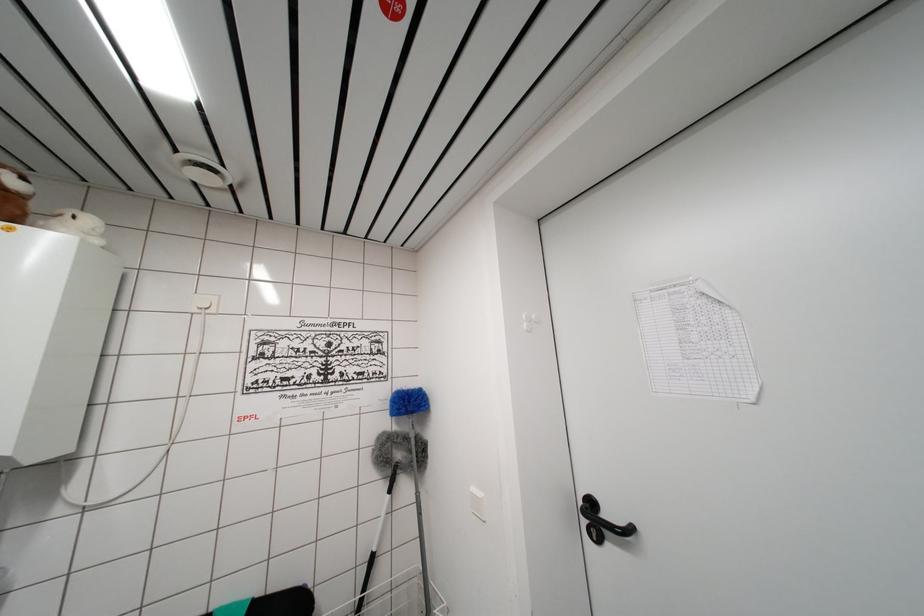
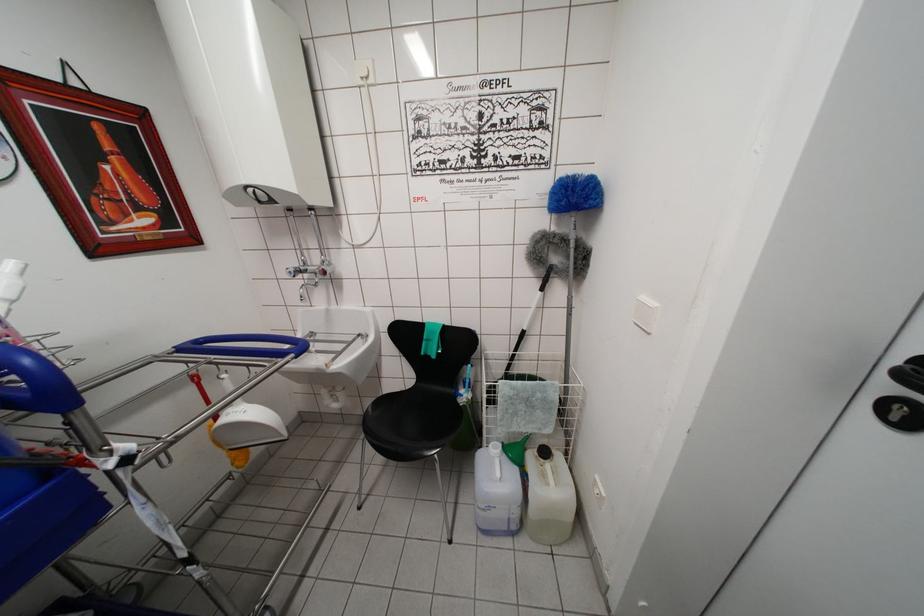
Where in the second image is the point corresponding to point 402,415 from the first image?

(562, 206)